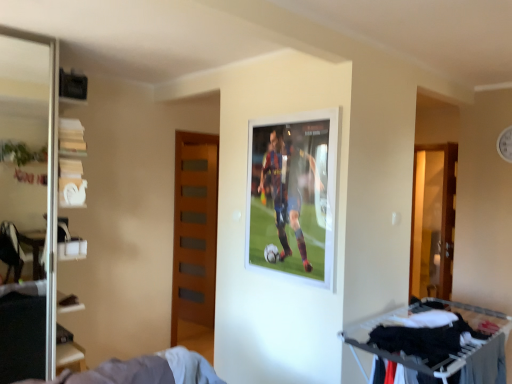
Question: Is wooden door at center-left smaller than transparent glass screen door at left?

Choices:
 (A) yes
 (B) no

Answer: (A)

Question: Is wooden door at center-left in front of transparent glass screen door at left?

Choices:
 (A) yes
 (B) no

Answer: (B)

Question: Considering the relative positions of wooden door at center-left and transparent glass screen door at left in the image provided, is wooden door at center-left to the right of transparent glass screen door at left from the viewer's perspective?

Choices:
 (A) yes
 (B) no

Answer: (A)

Question: Can you confirm if wooden door at center-left is bigger than transparent glass screen door at left?

Choices:
 (A) no
 (B) yes

Answer: (A)

Question: From the image's perspective, is wooden door at center-left located above transparent glass screen door at left?

Choices:
 (A) no
 (B) yes

Answer: (A)

Question: Is wooden door at center-left not close to transparent glass screen door at left?

Choices:
 (A) no
 (B) yes

Answer: (B)

Question: From a real-world perspective, is white plastic shelves at left physically above wooden door at center-left?

Choices:
 (A) yes
 (B) no

Answer: (A)

Question: Is white plastic shelves at left completely or partially outside of wooden door at center-left?

Choices:
 (A) no
 (B) yes

Answer: (B)

Question: Is white plastic shelves at left to the left of wooden door at center-left from the viewer's perspective?

Choices:
 (A) yes
 (B) no

Answer: (A)

Question: From the image's perspective, is white plastic shelves at left beneath wooden door at center-left?

Choices:
 (A) yes
 (B) no

Answer: (B)

Question: From a real-world perspective, is white plastic shelves at left located beneath wooden door at center-left?

Choices:
 (A) yes
 (B) no

Answer: (B)

Question: Considering the relative sizes of white plastic shelves at left and wooden door at center-left in the image provided, is white plastic shelves at left bigger than wooden door at center-left?

Choices:
 (A) yes
 (B) no

Answer: (A)

Question: Is white fabric clothes rack at lower right positioned behind wooden door at center-left?

Choices:
 (A) yes
 (B) no

Answer: (B)